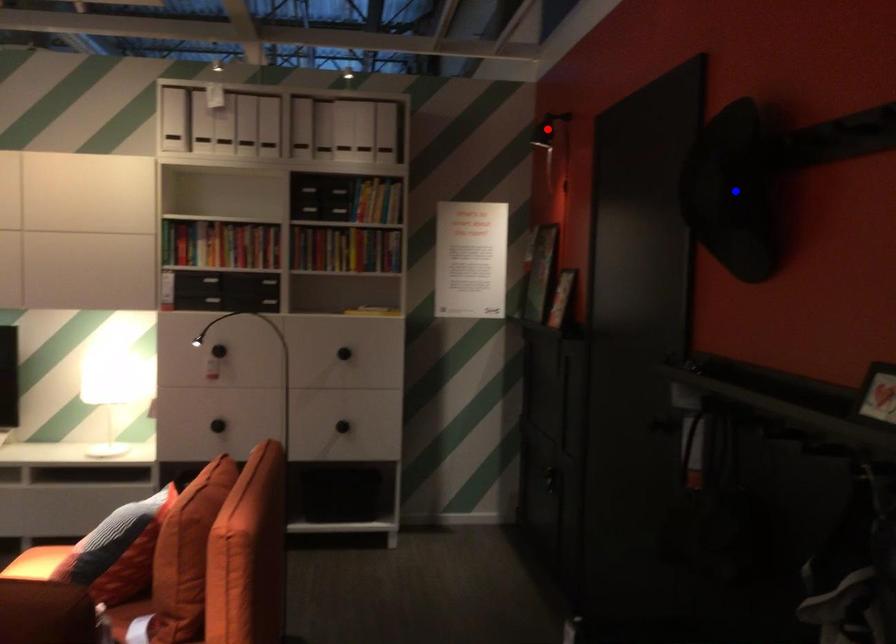
Question: Two points are marked on the image. Which point is closer to the camera?

Choices:
 (A) Blue point is closer.
 (B) Red point is closer.

Answer: (A)